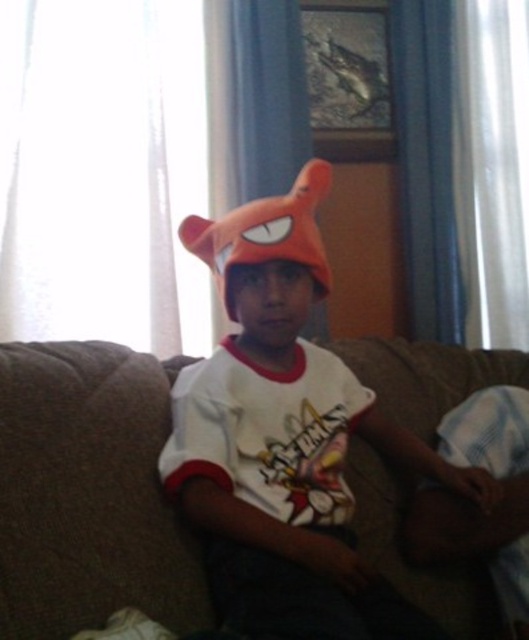
You are an interior designer assessing the room layout. You notice the matte orange hat at center and the white fabric at lower right. Which object occupies a greater area in the scene?

The matte orange hat at center is larger in size than the white fabric at lower right, so it occupies a greater area in the scene.

You are a photographer setting up a shoot in this room. You notice two hats, the matte orange hat at center and the orange plush hat at center, and want to ensure they are appropriately sized for the shoot. Which hat should you choose if you need a larger one for the photo?

The matte orange hat at center is bigger than the orange plush hat at center, so you should choose the matte orange hat at center for the photo if you need a larger one.